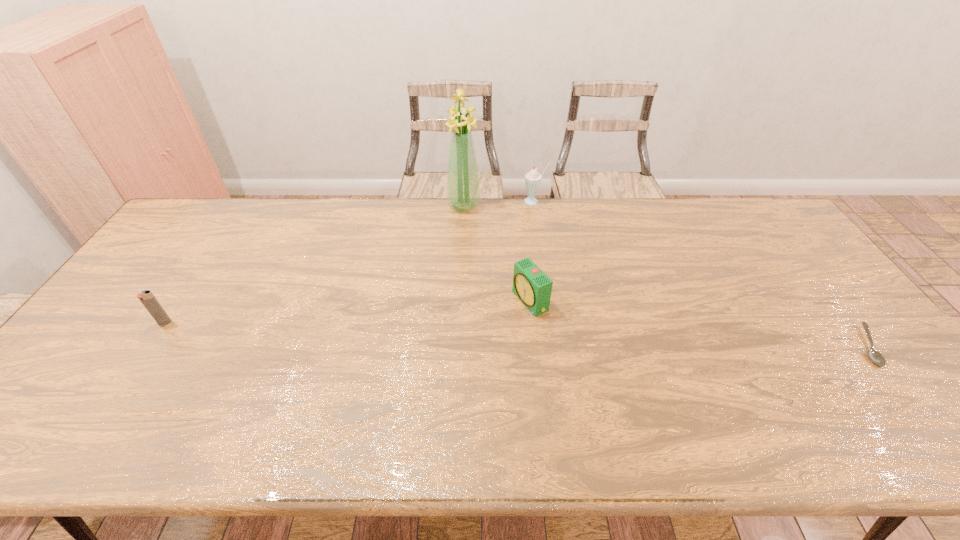
The height and width of the screenshot is (540, 960). Find the location of `free spot on the desktop that is between the igniter and the shortest object and is positioned on the front-facing side of the third nearest object`. free spot on the desktop that is between the igniter and the shortest object and is positioned on the front-facing side of the third nearest object is located at coordinates 461,332.

This screenshot has height=540, width=960. What are the coordinates of `free space on the desktop that is between the leftmost object and the soupspoon and is positioned on the straw side of the milkshake` in the screenshot? It's located at (456, 332).

The width and height of the screenshot is (960, 540). I want to click on vacant space on the desktop that is between the igniter and the shortest object and is positioned on the front-facing side of the bouquet, so click(x=436, y=332).